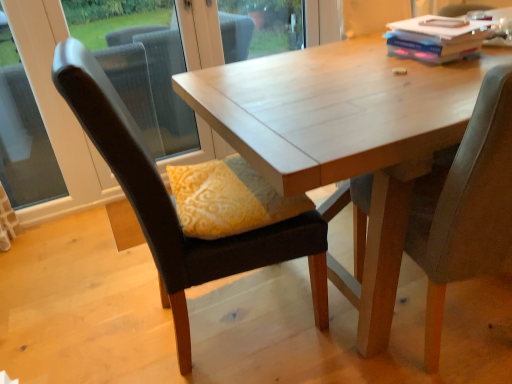
The image size is (512, 384). I want to click on free spot to the left of velvet dark brown chair at center, placed as the 1th chair when sorted from left to right, so click(x=102, y=301).